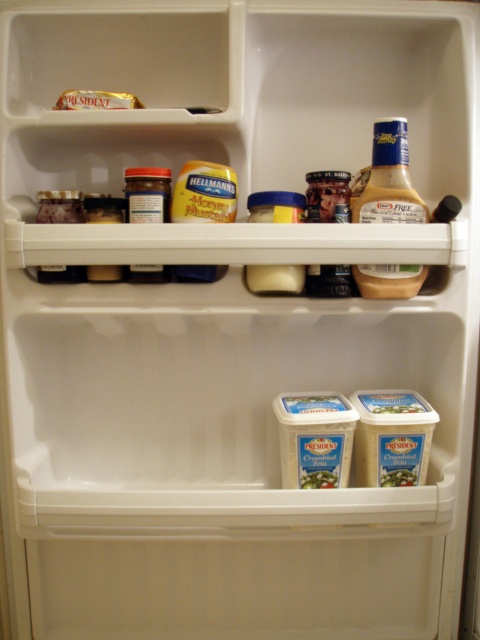
Can you confirm if matte glass jar at upper center is positioned below matte plastic mustard at upper left?

Actually, matte glass jar at upper center is above matte plastic mustard at upper left.

Which is more to the right, matte glass jar at upper center or matte plastic mustard at upper left?

Positioned to the right is matte glass jar at upper center.

Is point (129, 216) positioned in front of point (40, 192)?

Yes, point (129, 216) is closer to viewer.

The height and width of the screenshot is (640, 480). What are the coordinates of `matte glass jar at upper center` in the screenshot? It's located at (147, 195).

Who is positioned more to the right, blue plastic tub at lower center or white creamy tub at center?

blue plastic tub at lower center

Who is higher up, blue plastic tub at lower center or white creamy tub at center?

blue plastic tub at lower center

Where is `blue plastic tub at lower center`? blue plastic tub at lower center is located at coordinates (392, 436).

Can you confirm if translucent plastic bottle at upper right is positioned to the right of matte plastic mustard at upper left?

Answer: Correct, you'll find translucent plastic bottle at upper right to the right of matte plastic mustard at upper left.

Can you confirm if translucent plastic bottle at upper right is taller than matte plastic mustard at upper left?

Correct, translucent plastic bottle at upper right is much taller as matte plastic mustard at upper left.

Find the location of `translucent plastic bottle at upper right`. translucent plastic bottle at upper right is located at coordinates (389, 179).